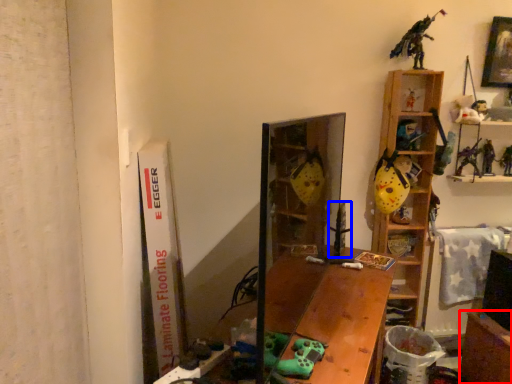
Question: Which of the following is the farthest to the observer, table (highlighted by a red box) or toy (highlighted by a blue box)?

Choices:
 (A) table
 (B) toy

Answer: (B)